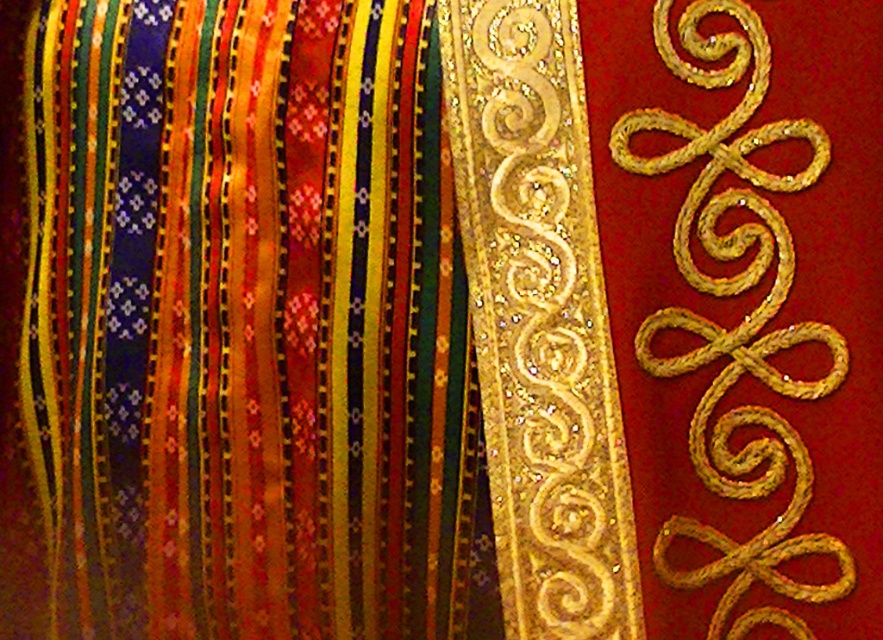
Question: Can you confirm if shiny metallic ribbons at left is positioned below gold glittery swirls at right?

Choices:
 (A) no
 (B) yes

Answer: (B)

Question: Considering the relative positions of shiny metallic ribbons at left and gold glittery swirls at right in the image provided, where is shiny metallic ribbons at left located with respect to gold glittery swirls at right?

Choices:
 (A) right
 (B) left

Answer: (B)

Question: Which object appears farthest from the camera in this image?

Choices:
 (A) shiny metallic ribbons at left
 (B) gold glittery swirls at right

Answer: (A)

Question: Is shiny metallic ribbons at left above gold glittery swirls at right?

Choices:
 (A) yes
 (B) no

Answer: (B)